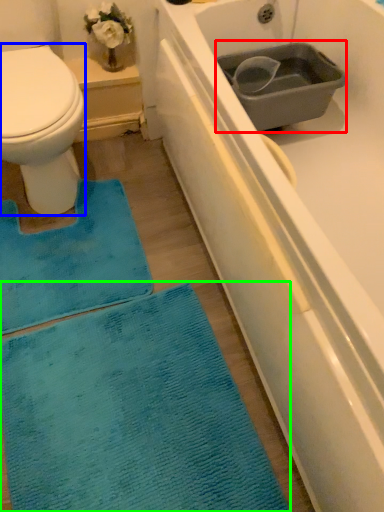
Question: Considering the real-world distances, which object is closest to sink (highlighted by a red box)? bidet (highlighted by a blue box) or bath mat (highlighted by a green box).

Choices:
 (A) bidet
 (B) bath mat

Answer: (A)